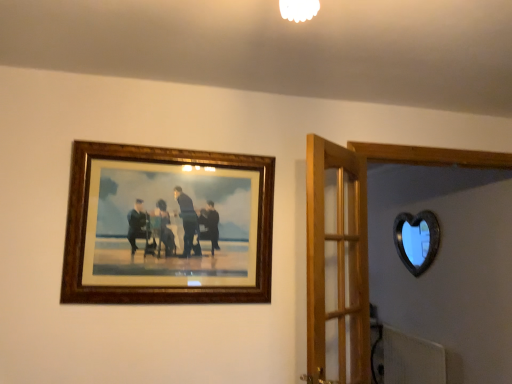
Find the location of `wooden door at center`. wooden door at center is located at coordinates (337, 262).

I want to click on black glass heart at upper right, so (416, 240).

Can you confirm if wooden door at center is wider than wooden frame at upper left?

Indeed, wooden door at center has a greater width compared to wooden frame at upper left.

Locate an element on the screen. The height and width of the screenshot is (384, 512). picture frame that appears above the wooden door at center (from the image's perspective) is located at coordinates (166, 226).

Is wooden door at center oriented away from wooden frame at upper left?

No, wooden frame at upper left is not at the back of wooden door at center.

Is point (319, 378) positioned before point (241, 190)?

Yes, it is.

The width and height of the screenshot is (512, 384). I want to click on door above the black glass heart at upper right (from the image's perspective), so click(337, 262).

Relative to wooden door at center, is black glass heart at upper right in front or behind?

Clearly, black glass heart at upper right is behind wooden door at center.

From the image's perspective, between black glass heart at upper right and wooden door at center, who is located below?

black glass heart at upper right, from the image's perspective.

In terms of height, does black glass heart at upper right look taller or shorter compared to wooden door at center?

black glass heart at upper right is shorter than wooden door at center.

Which of these two, wooden frame at upper left or black glass heart at upper right, stands taller?

wooden frame at upper left.

Between wooden frame at upper left and black glass heart at upper right, which one has smaller size?

black glass heart at upper right.

Consider the image. Is wooden frame at upper left placed right next to black glass heart at upper right?

No, wooden frame at upper left is not beside black glass heart at upper right.

Is black glass heart at upper right positioned beyond the bounds of wooden frame at upper left?

Yes, black glass heart at upper right is located beyond the bounds of wooden frame at upper left.

Can you confirm if black glass heart at upper right is thinner than wooden frame at upper left?

Yes.

Based on the photo, is there a large distance between black glass heart at upper right and wooden frame at upper left?

Indeed, black glass heart at upper right is not near wooden frame at upper left.

Identify the location of picture frame that appears above the black glass heart at upper right (from a real-world perspective). (166, 226).

Relative to black glass heart at upper right, is wooden door at center in front or behind?

wooden door at center is in front of black glass heart at upper right.

From the image's perspective, would you say wooden door at center is shown under black glass heart at upper right?

Incorrect, from the image's perspective, wooden door at center is higher than black glass heart at upper right.

In the scene shown: Can you confirm if wooden door at center is bigger than black glass heart at upper right?

Indeed, wooden door at center has a larger size compared to black glass heart at upper right.

Which is more distant, (334, 246) or (412, 229)?

The point (412, 229) is farther from the camera.

Considering the sizes of wooden frame at upper left and wooden door at center in the image, is wooden frame at upper left wider or thinner than wooden door at center?

In the image, wooden frame at upper left appears to be more narrow than wooden door at center.

Between wooden frame at upper left and wooden door at center, which one has less height?

With less height is wooden frame at upper left.

Could wooden door at center be considered to be inside wooden frame at upper left?

No, wooden frame at upper left does not contain wooden door at center.

From a real-world perspective, between wooden frame at upper left and wooden door at center, who is vertically lower?

wooden door at center is physically lower.

The width and height of the screenshot is (512, 384). I want to click on door that appears in front of the wooden frame at upper left, so click(x=337, y=262).

Locate an element on the screen. The height and width of the screenshot is (384, 512). door that appears above the black glass heart at upper right (from the image's perspective) is located at coordinates (337, 262).

When comparing their distances from black glass heart at upper right, does wooden frame at upper left or wooden door at center seem further?

Among the two, wooden frame at upper left is located further to black glass heart at upper right.

Based on their spatial positions, is black glass heart at upper right or wooden frame at upper left further from wooden door at center?

black glass heart at upper right is further to wooden door at center.

Considering their positions, is wooden frame at upper left positioned further to wooden door at center than black glass heart at upper right?

black glass heart at upper right is further to wooden door at center.

Which object lies nearer to the anchor point black glass heart at upper right, wooden door at center or wooden frame at upper left?

Among the two, wooden door at center is located nearer to black glass heart at upper right.

Which object lies further to the anchor point wooden frame at upper left, wooden door at center or black glass heart at upper right?

black glass heart at upper right lies further to wooden frame at upper left than the other object.

Looking at the image, which one is located further to wooden frame at upper left, black glass heart at upper right or wooden door at center?

black glass heart at upper right is positioned further to the anchor wooden frame at upper left.

The height and width of the screenshot is (384, 512). What are the coordinates of `picture frame positioned between wooden door at center and black glass heart at upper right from near to far` in the screenshot? It's located at (166, 226).